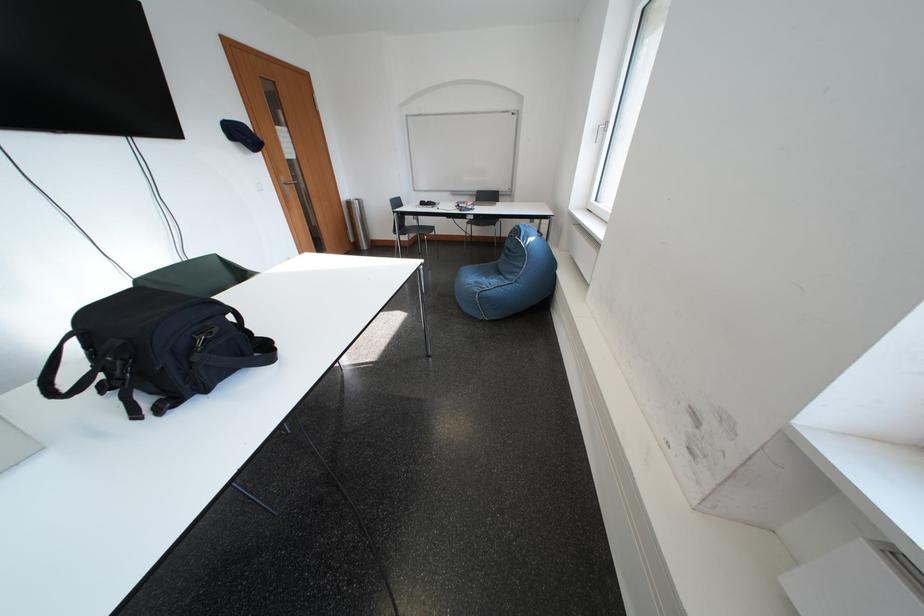
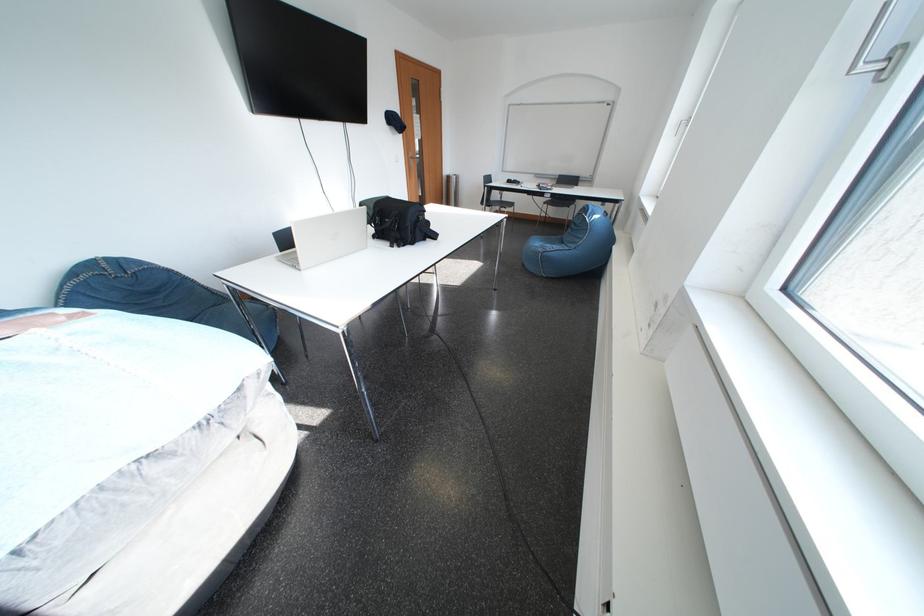
Where in the second image is the point corresponding to point 487,219 from the first image?

(563, 198)